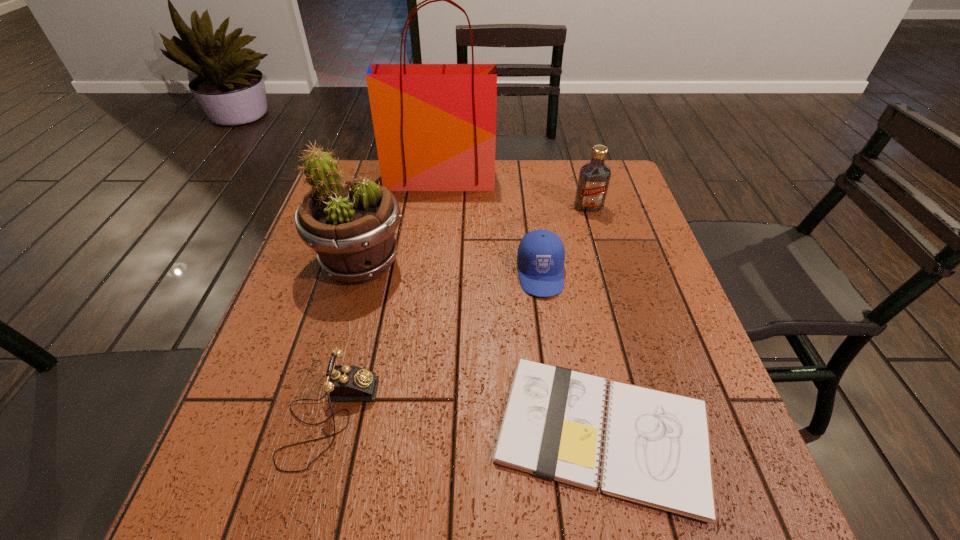
Locate an element on the screen. The height and width of the screenshot is (540, 960). vacant space located on the front-facing side of the third tallest object is located at coordinates (616, 302).

You are a GUI agent. You are given a task and a screenshot of the screen. Output one action in this format:
    pyautogui.click(x=<x>, y=<y>)
    Task: Click on the free region located on the front-facing side of the cap
    
    Given the screenshot: What is the action you would take?
    pyautogui.click(x=549, y=338)

The height and width of the screenshot is (540, 960). Identify the location of vacant space positioned on the dial of the telephone. (503, 417).

At what (x,y) coordinates should I click in order to perform the action: click on vacant space located 0.400m on the back of the notepad. Please return your answer as a coordinate pair (x, y). This screenshot has height=540, width=960. Looking at the image, I should click on (563, 236).

Where is `shopping bag positioned at the far edge`? shopping bag positioned at the far edge is located at coordinates (435, 124).

Where is `vodka located in the far edge section of the desktop`? vodka located in the far edge section of the desktop is located at coordinates (594, 177).

Locate an element on the screen. This screenshot has height=540, width=960. object present at the near edge is located at coordinates (656, 452).

Where is `shopping bag located in the left edge section of the desktop`? shopping bag located in the left edge section of the desktop is located at coordinates (435, 124).

Locate an element on the screen. The height and width of the screenshot is (540, 960). flowerpot positioned at the left edge is located at coordinates (350, 224).

Locate an element on the screen. telephone present at the left edge is located at coordinates (344, 382).